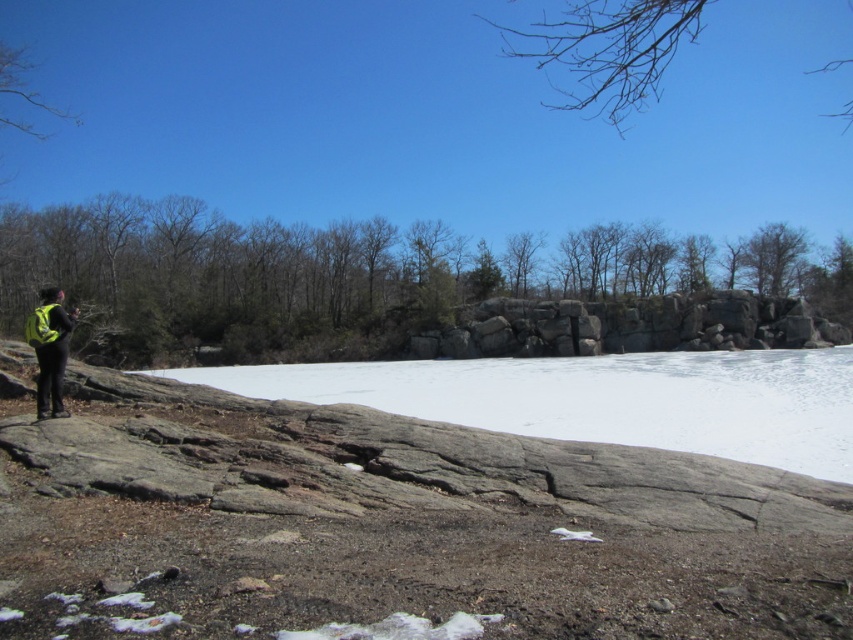
Question: Does white matte snow at center have a lesser width compared to neon yellow backpack at left?

Choices:
 (A) no
 (B) yes

Answer: (A)

Question: Where is white matte snow at center located in relation to neon yellow backpack at left in the image?

Choices:
 (A) above
 (B) below

Answer: (B)

Question: Which of the following is the farthest from the observer?

Choices:
 (A) gray/rocky rock formation at center
 (B) white matte snow at center
 (C) neon yellow backpack at left

Answer: (A)

Question: Which point is farther to the camera?

Choices:
 (A) (502, 428)
 (B) (647, 332)

Answer: (B)

Question: Which point is closer to the camera?

Choices:
 (A) (511, 298)
 (B) (53, 301)
 (C) (483, 376)

Answer: (B)

Question: Where is white matte snow at center located in relation to neon yellow backpack at left in the image?

Choices:
 (A) below
 (B) above

Answer: (A)